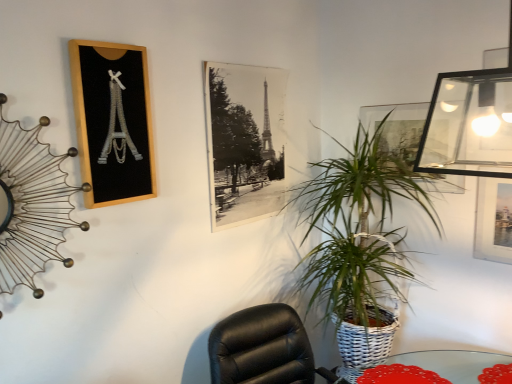
Locate an element on the screen. green woven basket at center-right is located at coordinates (358, 244).

Where is `black paper at center, which appears as the second picture frame when viewed from the left`? The height and width of the screenshot is (384, 512). black paper at center, which appears as the second picture frame when viewed from the left is located at coordinates (245, 141).

What is the approximate height of clear glass table at lower right?

The height of clear glass table at lower right is 1.56 inches.

The image size is (512, 384). What do you see at coordinates (397, 128) in the screenshot?
I see `transparent glass picture frame at upper right, the first picture frame positioned from the right` at bounding box center [397, 128].

Find the location of a particular element. This screenshot has width=512, height=384. green woven basket at center-right is located at coordinates (358, 244).

Would you say transparent glass picture frame at upper right, placed as the 3th picture frame when sorted from left to right, is a long distance from black paper at center, which appears as the second picture frame when viewed from the left?

transparent glass picture frame at upper right, placed as the 3th picture frame when sorted from left to right, is near black paper at center, which appears as the second picture frame when viewed from the left, not far away.

Is black paper at center, which appears as the second picture frame when viewed from the left, surrounded by transparent glass picture frame at upper right, placed as the 3th picture frame when sorted from left to right?

That's incorrect, black paper at center, which appears as the second picture frame when viewed from the left, is not inside transparent glass picture frame at upper right, placed as the 3th picture frame when sorted from left to right.

Can you confirm if transparent glass picture frame at upper right, placed as the 3th picture frame when sorted from left to right, is thinner than black paper at center, which appears as the second picture frame when viewed from the left?

No.

Is black paper at center, which appears as the second picture frame when viewed from the left, at the back of transparent glass picture frame at upper right, the first picture frame positioned from the right?

That's not correct — transparent glass picture frame at upper right, the first picture frame positioned from the right, is not looking away from black paper at center, which appears as the second picture frame when viewed from the left.

From the image's perspective, is gold wire clock at upper left positioned above or below clear glass table at lower right?

gold wire clock at upper left is situated higher than clear glass table at lower right in the image.

In the scene shown: Is gold wire clock at upper left to the left of clear glass table at lower right from the viewer's perspective?

Correct, you'll find gold wire clock at upper left to the left of clear glass table at lower right.

Is there a large distance between gold wire clock at upper left and clear glass table at lower right?

gold wire clock at upper left is positioned a significant distance from clear glass table at lower right.

Can clear glass table at lower right be found inside gold wire clock at upper left?

That's incorrect, clear glass table at lower right is not inside gold wire clock at upper left.

Is clear glass table at lower right bigger or smaller than black paper at center, which appears as the second picture frame when viewed from the left?

Considering their sizes, clear glass table at lower right takes up less space than black paper at center, which appears as the second picture frame when viewed from the left.

Consider the image. From a real-world perspective, is clear glass table at lower right located beneath black paper at center, which appears as the second picture frame when viewed from the left?

Yes, from a real-world perspective, clear glass table at lower right is below black paper at center, which appears as the second picture frame when viewed from the left.

From the image's perspective, is clear glass table at lower right on black paper at center, which appears as the second picture frame when viewed from the left?

Incorrect, from the image's perspective, clear glass table at lower right is lower than black paper at center, which appears as the second picture frame when viewed from the left.

Are clear glass table at lower right and black paper at center, the 2th picture frame positioned from the right, located far from each other?

clear glass table at lower right is positioned a significant distance from black paper at center, the 2th picture frame positioned from the right.

Is green woven basket at center-right bigger or smaller than black paper at center, the 2th picture frame positioned from the right?

Considering their sizes, green woven basket at center-right takes up more space than black paper at center, the 2th picture frame positioned from the right.

How much distance is there between green woven basket at center-right and black paper at center, the 2th picture frame positioned from the right?

They are 19.04 inches apart.

From the image's perspective, between green woven basket at center-right and black paper at center, which appears as the second picture frame when viewed from the left, who is located below?

green woven basket at center-right.

Is green woven basket at center-right positioned behind black paper at center, which appears as the second picture frame when viewed from the left?

No, it is in front of black paper at center, which appears as the second picture frame when viewed from the left.

From the picture: In the image, is gold wire clock at upper left positioned in front of or behind black paper at center, the 2th picture frame positioned from the right?

In the image, gold wire clock at upper left appears in front of black paper at center, the 2th picture frame positioned from the right.

Is gold wire clock at upper left next to black paper at center, which appears as the second picture frame when viewed from the left, and touching it?

No.

Find the location of a particular element. The width and height of the screenshot is (512, 384). clock in front of the black paper at center, which appears as the second picture frame when viewed from the left is located at coordinates (x=31, y=204).

From the image's perspective, which one is positioned higher, clear glass table at lower right or wooden picture frame at upper left, acting as the first picture frame starting from the left?

wooden picture frame at upper left, acting as the first picture frame starting from the left, appears higher in the image.

From a real-world perspective, is clear glass table at lower right below wooden picture frame at upper left, acting as the first picture frame starting from the left?

Indeed, from a real-world perspective, clear glass table at lower right is positioned beneath wooden picture frame at upper left, acting as the first picture frame starting from the left.

Would you say clear glass table at lower right is a long distance from wooden picture frame at upper left, the 3th picture frame from the right?

Yes, clear glass table at lower right and wooden picture frame at upper left, the 3th picture frame from the right, are quite far apart.

Which is correct: clear glass table at lower right is inside wooden picture frame at upper left, acting as the first picture frame starting from the left, or outside of it?

clear glass table at lower right is located beyond the bounds of wooden picture frame at upper left, acting as the first picture frame starting from the left.

From the image's perspective, does wooden picture frame at upper left, acting as the first picture frame starting from the left, appear higher than clear glass table at lower right?

Indeed, from the image's perspective, wooden picture frame at upper left, acting as the first picture frame starting from the left, is shown above clear glass table at lower right.

Which object is closer to the camera, wooden picture frame at upper left, the 3th picture frame from the right, or clear glass table at lower right?

wooden picture frame at upper left, the 3th picture frame from the right, is in front.

Could you tell me if wooden picture frame at upper left, the 3th picture frame from the right, is facing clear glass table at lower right?

No, wooden picture frame at upper left, the 3th picture frame from the right, is not aimed at clear glass table at lower right.

You are a GUI agent. You are given a task and a screenshot of the screen. Output one action in this format:
    pyautogui.click(x=<x>, y=<y>)
    Task: Click on the picture frame that is the 1st one when counting forward from the transparent glass picture frame at upper right, the first picture frame positioned from the right
    
    Given the screenshot: What is the action you would take?
    pyautogui.click(x=245, y=141)

You are a GUI agent. You are given a task and a screenshot of the screen. Output one action in this format:
    pyautogui.click(x=<x>, y=<y>)
    Task: Click on the clock lying above the clear glass table at lower right (from the image's perspective)
    The width and height of the screenshot is (512, 384).
    Given the screenshot: What is the action you would take?
    pyautogui.click(x=31, y=204)

Estimate the real-world distances between objects in this image. Which object is closer to gold wire clock at upper left, wooden picture frame at upper left, the 3th picture frame from the right, or green woven basket at center-right?

wooden picture frame at upper left, the 3th picture frame from the right, is positioned closer to the anchor gold wire clock at upper left.

Looking at this image, from the image, which object appears to be farther from gold wire clock at upper left, black paper at center, the 2th picture frame positioned from the right, or green woven basket at center-right?

green woven basket at center-right lies further to gold wire clock at upper left than the other object.

Looking at the image, which one is located further to clear glass table at lower right, gold wire clock at upper left or green woven basket at center-right?

gold wire clock at upper left is positioned further to the anchor clear glass table at lower right.

Which object lies nearer to the anchor point clear glass table at lower right, green woven basket at center-right or transparent glass picture frame at upper right, the first picture frame positioned from the right?

The object closer to clear glass table at lower right is green woven basket at center-right.

When comparing their distances from wooden picture frame at upper left, acting as the first picture frame starting from the left, does gold wire clock at upper left or green woven basket at center-right seem closer?

gold wire clock at upper left lies closer to wooden picture frame at upper left, acting as the first picture frame starting from the left, than the other object.

Considering their positions, is green woven basket at center-right positioned closer to gold wire clock at upper left than black paper at center, which appears as the second picture frame when viewed from the left?

The object closer to gold wire clock at upper left is black paper at center, which appears as the second picture frame when viewed from the left.

Considering their positions, is green woven basket at center-right positioned further to black paper at center, which appears as the second picture frame when viewed from the left, than transparent glass picture frame at upper right, the first picture frame positioned from the right?

The object further to black paper at center, which appears as the second picture frame when viewed from the left, is transparent glass picture frame at upper right, the first picture frame positioned from the right.

From the image, which object appears to be nearer to gold wire clock at upper left, black paper at center, which appears as the second picture frame when viewed from the left, or wooden picture frame at upper left, acting as the first picture frame starting from the left?

Based on the image, wooden picture frame at upper left, acting as the first picture frame starting from the left, appears to be nearer to gold wire clock at upper left.

Image resolution: width=512 pixels, height=384 pixels. In order to click on houseplant between gold wire clock at upper left and clear glass table at lower right in this screenshot , I will do `click(358, 244)`.

This screenshot has height=384, width=512. In order to click on picture frame between transparent glass picture frame at upper right, placed as the 3th picture frame when sorted from left to right, and clear glass table at lower right, in the vertical direction in this screenshot , I will do `click(245, 141)`.

Image resolution: width=512 pixels, height=384 pixels. I want to click on picture frame located between wooden picture frame at upper left, the 3th picture frame from the right, and green woven basket at center-right in the left-right direction, so click(245, 141).

What are the coordinates of `houseplant located between gold wire clock at upper left and transparent glass picture frame at upper right, placed as the 3th picture frame when sorted from left to right, in the left-right direction` in the screenshot? It's located at (358, 244).